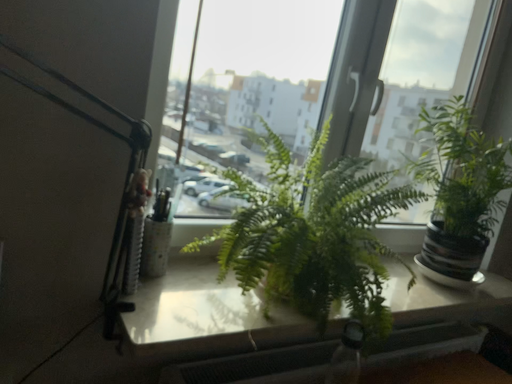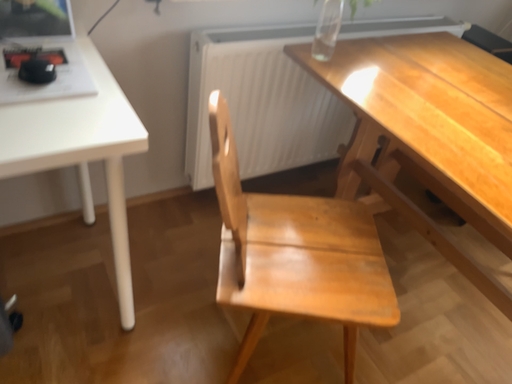
Question: How did the camera likely rotate when shooting the video?

Choices:
 (A) rotated upward
 (B) rotated downward

Answer: (B)